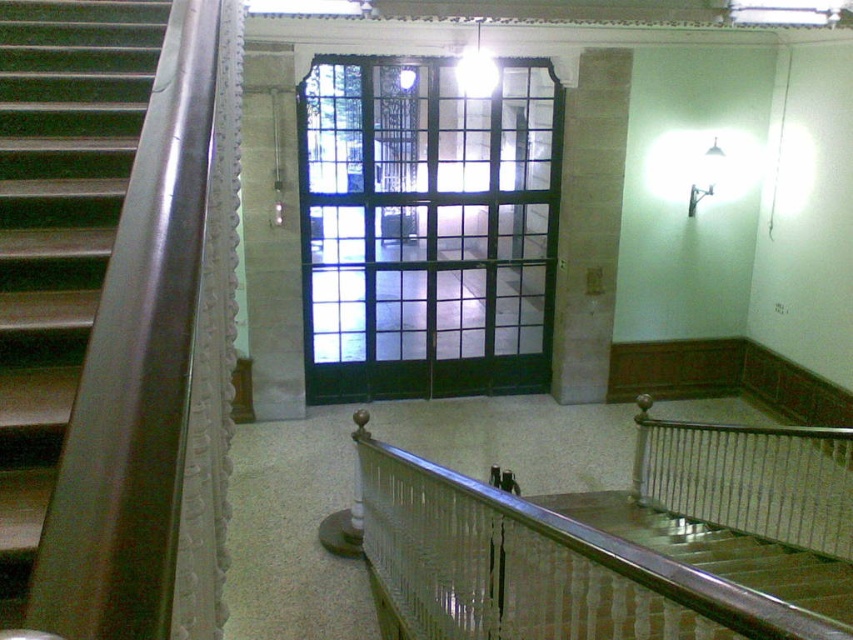
Who is taller, metallic polished handrail at lower center or gray stone pillar at center?

gray stone pillar at center

Does metallic polished handrail at lower center appear on the right side of gray stone pillar at center?

Incorrect, metallic polished handrail at lower center is not on the right side of gray stone pillar at center.

Who is more distant from viewer, (663, 616) or (596, 76)?

The point (596, 76) is behind.

The width and height of the screenshot is (853, 640). I want to click on metallic polished handrail at lower center, so click(x=532, y=566).

Looking at this image, between black glass door at center and metallic gray stairs at left, which one has more height?

black glass door at center

Describe the element at coordinates (426, 228) in the screenshot. I see `black glass door at center` at that location.

Locate an element on the screen. The image size is (853, 640). black glass door at center is located at coordinates (426, 228).

Is metallic gray stairs at left taller than metallic polished handrail at lower center?

Indeed, metallic gray stairs at left has a greater height compared to metallic polished handrail at lower center.

Who is taller, metallic gray stairs at left or metallic polished handrail at lower center?

Standing taller between the two is metallic gray stairs at left.

You are a GUI agent. You are given a task and a screenshot of the screen. Output one action in this format:
    pyautogui.click(x=<x>, y=<y>)
    Task: Click on the metallic gray stairs at left
    
    Given the screenshot: What is the action you would take?
    pyautogui.click(x=57, y=228)

Image resolution: width=853 pixels, height=640 pixels. In order to click on metallic gray stairs at left in this screenshot , I will do `click(57, 228)`.